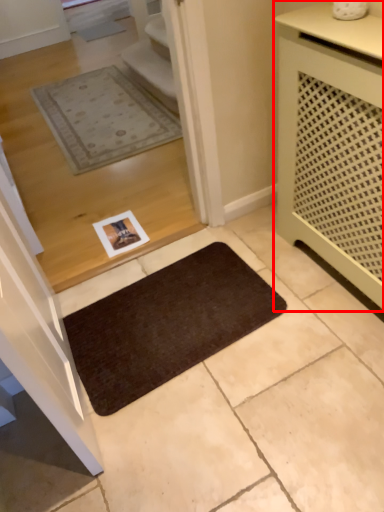
Question: From the image's perspective, where is cabinetry (annotated by the red box) located in relation to mat in the image?

Choices:
 (A) below
 (B) above

Answer: (B)